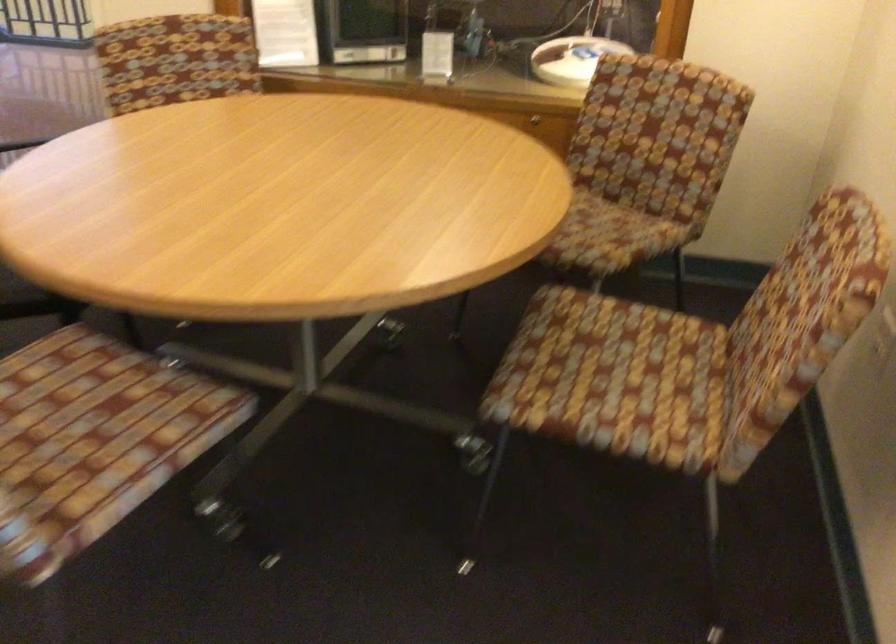
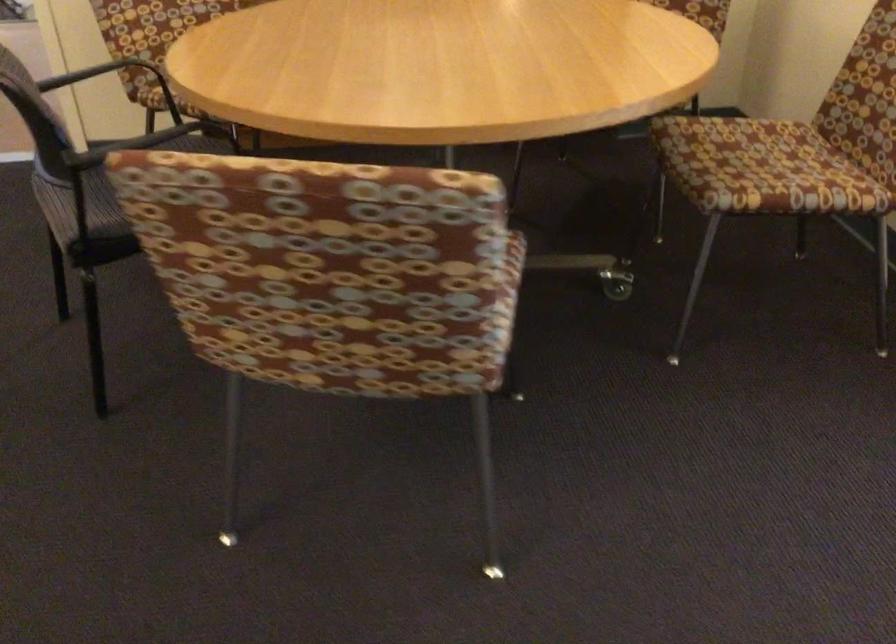
Question: The images are taken continuously from a first-person perspective. In which direction is your viewpoint rotating?

Choices:
 (A) Left
 (B) Right
 (C) Up
 (D) Down

Answer: (B)